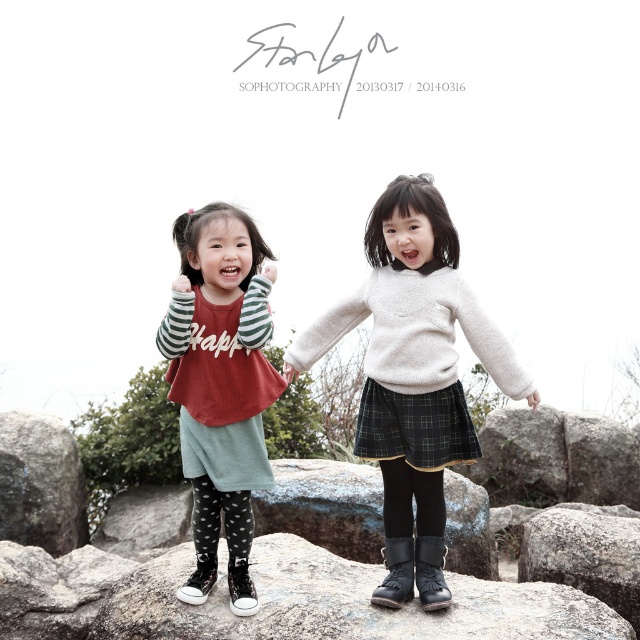
Question: Which point is closer to the camera?

Choices:
 (A) gray rough boulder at lower left
 (B) shiny beige sweater at center

Answer: (B)

Question: Can you confirm if black leather boot at lower center is thinner than black suede boot at lower center?

Choices:
 (A) no
 (B) yes

Answer: (A)

Question: Does green cotton skirt at center have a larger size compared to black rubber boot at lower center?

Choices:
 (A) no
 (B) yes

Answer: (B)

Question: Which point appears closest to the camera in this image?

Choices:
 (A) (241, 557)
 (B) (209, 566)

Answer: (A)

Question: Is gray rough boulder at lower left to the right of black textured boulder at center from the viewer's perspective?

Choices:
 (A) yes
 (B) no

Answer: (B)

Question: Which of the following is the closest to the observer?

Choices:
 (A) black textured boulder at center
 (B) shiny beige sweater at center
 (C) black canvas boot at lower center

Answer: (B)